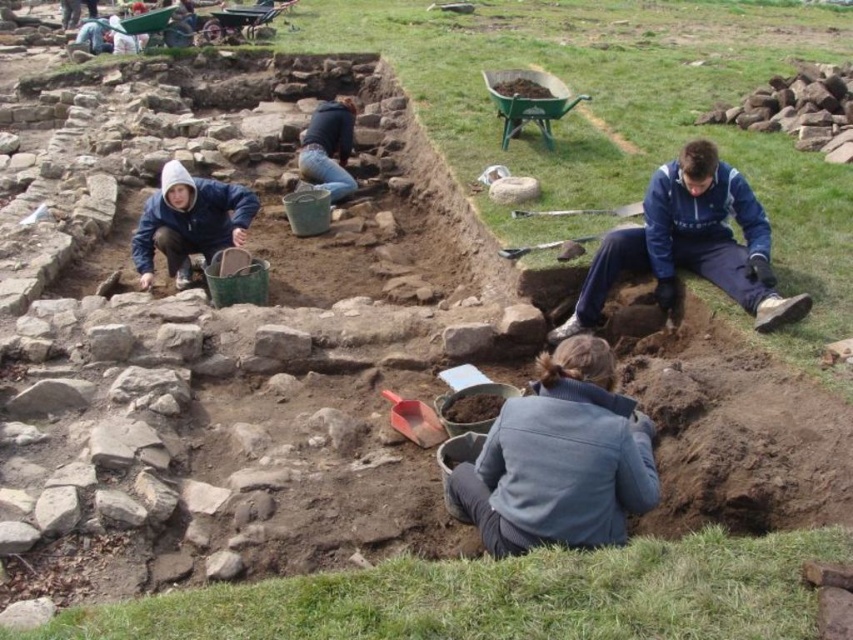
You are an archaeologist standing at the edge of the excavation site. You notice blue denim jeans at center located at point (328, 147). What object is present at that specific coordinate?

At point (328, 147) lies blue denim jeans at center.

You are standing at the edge of an archaeological excavation site. You see the blue fleece jacket at lower right and the brushed metal shovel at center. Which object is closer to the ground?

The blue fleece jacket at lower right is positioned under the brushed metal shovel at center, so it is closer to the ground.

You are an archaeologist at the excavation site. You need to determine which item is narrower between the blue denim jeans at center and the smooth wooden shovel at center. Which one is narrower?

The blue denim jeans at center is narrower than the smooth wooden shovel at center.